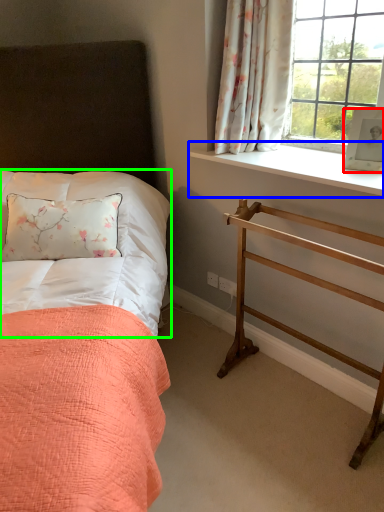
Question: Estimate the real-world distances between objects in this image. Which object is farther from picture frame (highlighted by a red box), window sill (highlighted by a blue box) or sheet (highlighted by a green box)?

Choices:
 (A) window sill
 (B) sheet

Answer: (B)